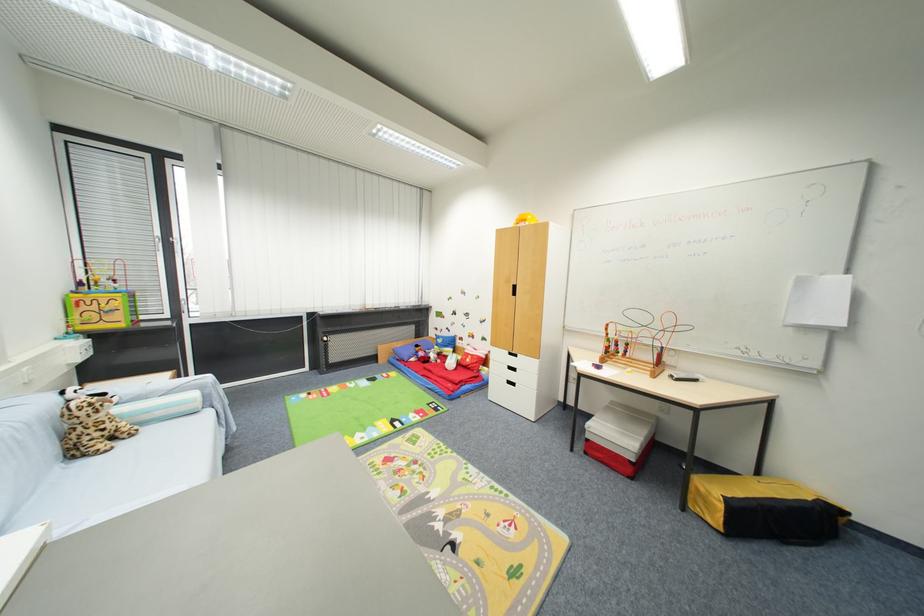
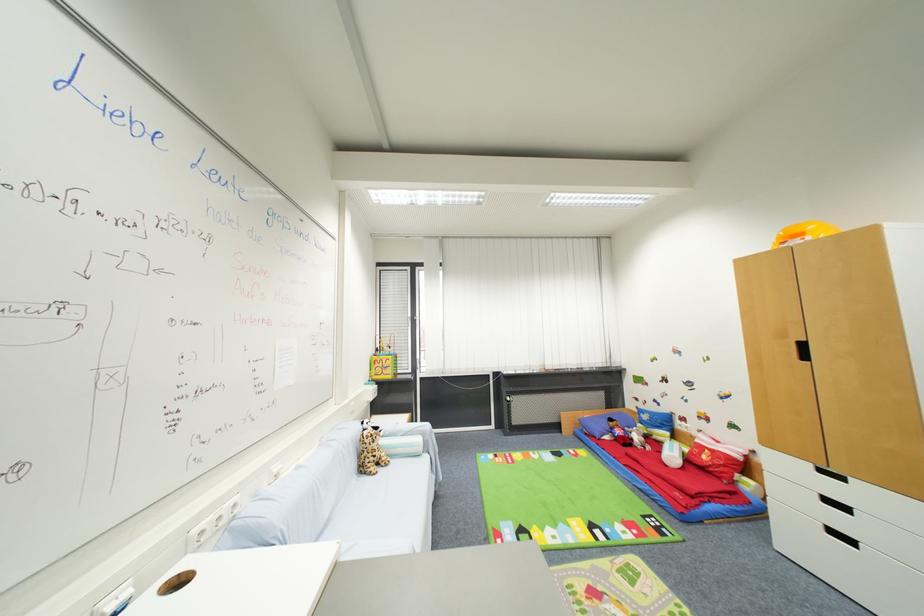
Where in the second image is the point corresponding to point (518, 371) from the first image?

(849, 509)